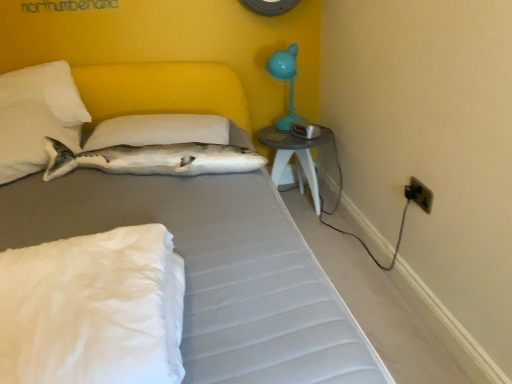
Question: Is matte gray table at right bigger or smaller than white soft pillow at upper left, which ranks as the second pillow in front-to-back order?

Choices:
 (A) small
 (B) big

Answer: (A)

Question: In the image, is matte gray table at right positioned in front of or behind white soft pillow at upper left, which ranks as the second pillow in front-to-back order?

Choices:
 (A) front
 (B) behind

Answer: (B)

Question: Estimate the real-world distances between objects in this image. Which object is closer to the white soft pillow at upper center, which is counted as the 1th pillow, starting from the back?

Choices:
 (A) white soft pillow at lower left, the third pillow viewed from the back
 (B) matte gray table at right
 (C) teal plastic table lamp at upper right
 (D) black plastic electrical outlet at lower right
 (E) white soft pillow at upper left, which ranks as the second pillow in front-to-back order

Answer: (E)

Question: Which is farther from the white soft pillow at lower left, the third pillow viewed from the back?

Choices:
 (A) teal plastic table lamp at upper right
 (B) white soft pillow at upper center, which is counted as the 1th pillow, starting from the back
 (C) black plastic electrical outlet at lower right
 (D) white plush fish at upper left
 (E) gray fabric bed at center

Answer: (A)